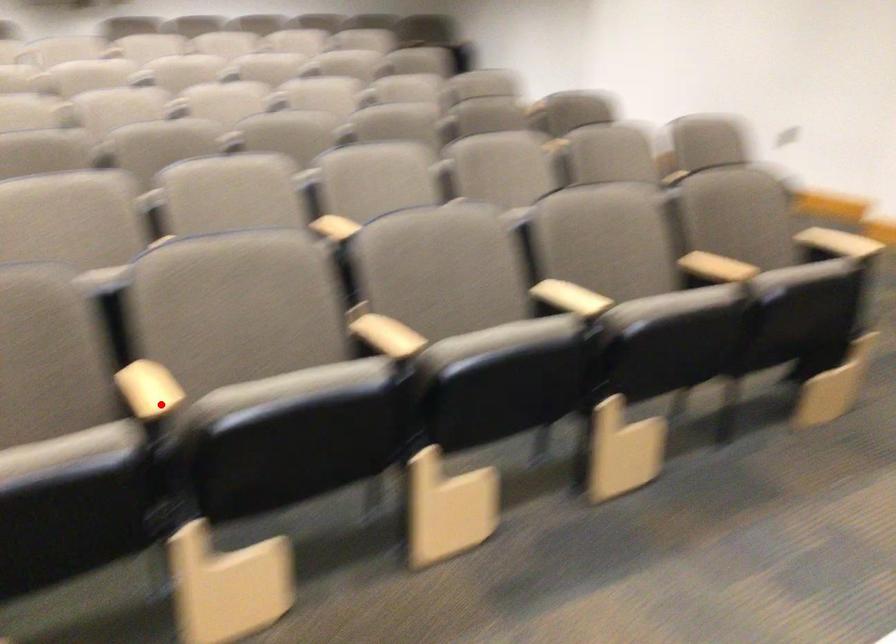
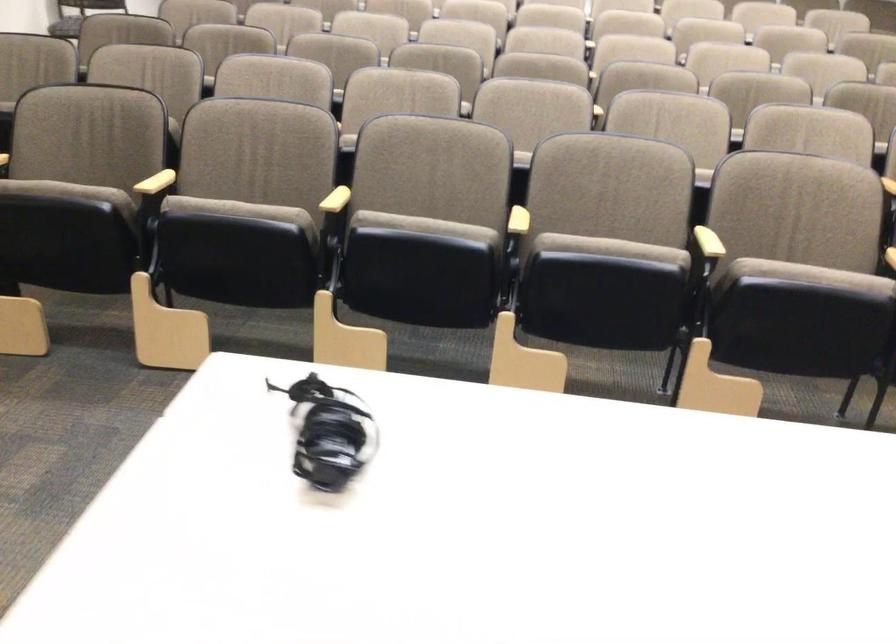
The point at the highlighted location is marked in the first image. Where is the corresponding point in the second image?

(336, 200)